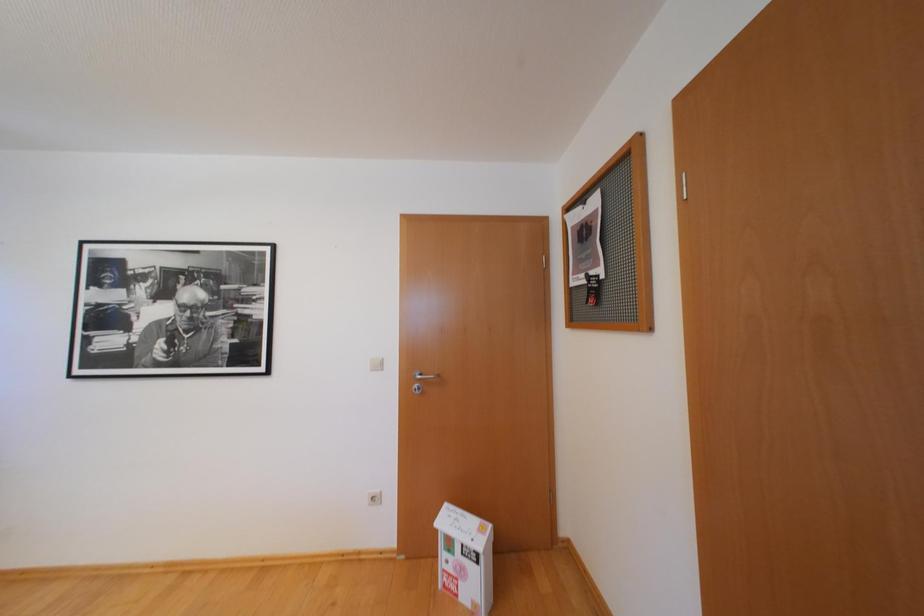
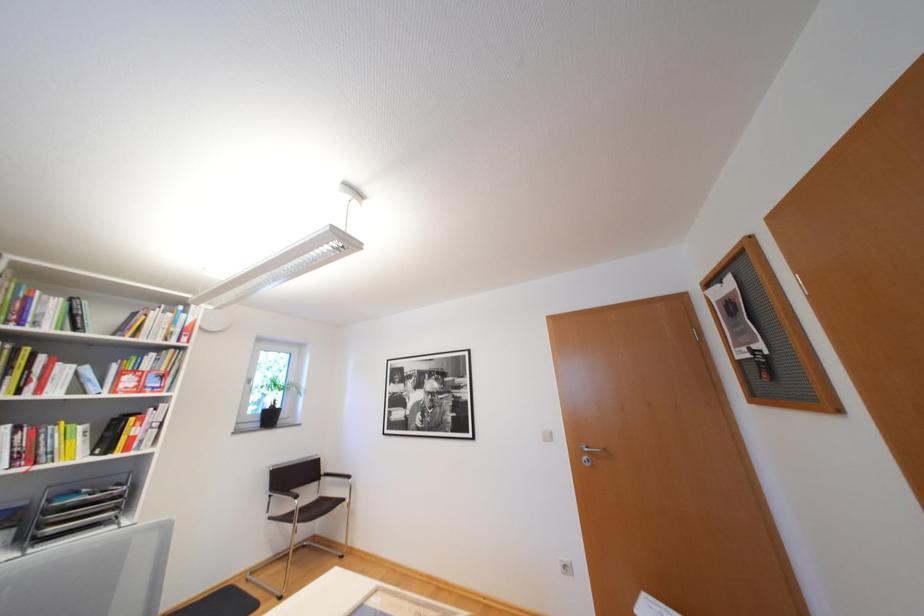
The first image is from the beginning of the video and the second image is from the end. How did the camera likely rotate when shooting the video?

The rotation direction of the camera is left-up.